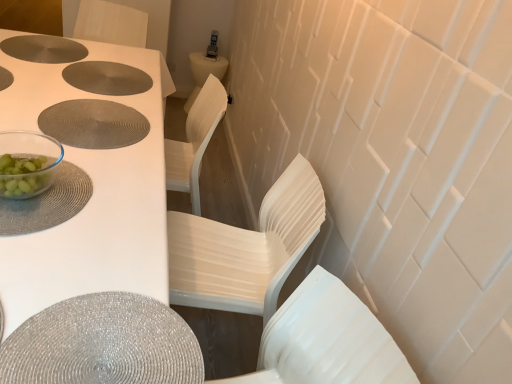
Find the location of `vacant space in matte gray placemat at upper left, placed as the 3th hole when sorted from bottom to top (from a real-world perspective)`. vacant space in matte gray placemat at upper left, placed as the 3th hole when sorted from bottom to top (from a real-world perspective) is located at coordinates (35, 48).